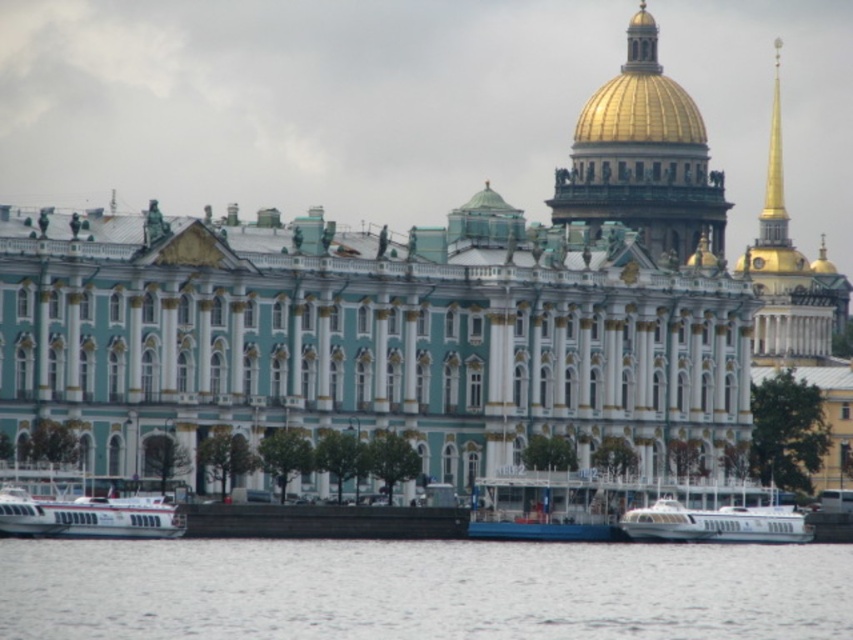
Is blue painted metal boat at center taller than white matte boat at lower left?

No, blue painted metal boat at center is not taller than white matte boat at lower left.

Between blue painted metal boat at center and white matte boat at lower left, which one has more height?

With more height is white matte boat at lower left.

Does point (556, 496) come farther from viewer compared to point (62, 529)?

That is True.

Where is `blue painted metal boat at center`? The width and height of the screenshot is (853, 640). blue painted metal boat at center is located at coordinates (547, 506).

Is white water at lower center to the right of white matte boat at lower left from the viewer's perspective?

Yes, white water at lower center is to the right of white matte boat at lower left.

You are a GUI agent. You are given a task and a screenshot of the screen. Output one action in this format:
    pyautogui.click(x=<x>, y=<y>)
    Task: Click on the white water at lower center
    
    Given the screenshot: What is the action you would take?
    pyautogui.click(x=421, y=589)

From the picture: Is gold polished dome at upper center thinner than white glossy boat at lower center?

In fact, gold polished dome at upper center might be wider than white glossy boat at lower center.

Is gold polished dome at upper center above white glossy boat at lower center?

Yes, gold polished dome at upper center is above white glossy boat at lower center.

What do you see at coordinates (640, 99) in the screenshot?
I see `gold polished dome at upper center` at bounding box center [640, 99].

Where is `gold polished dome at upper center`? The image size is (853, 640). gold polished dome at upper center is located at coordinates 640,99.